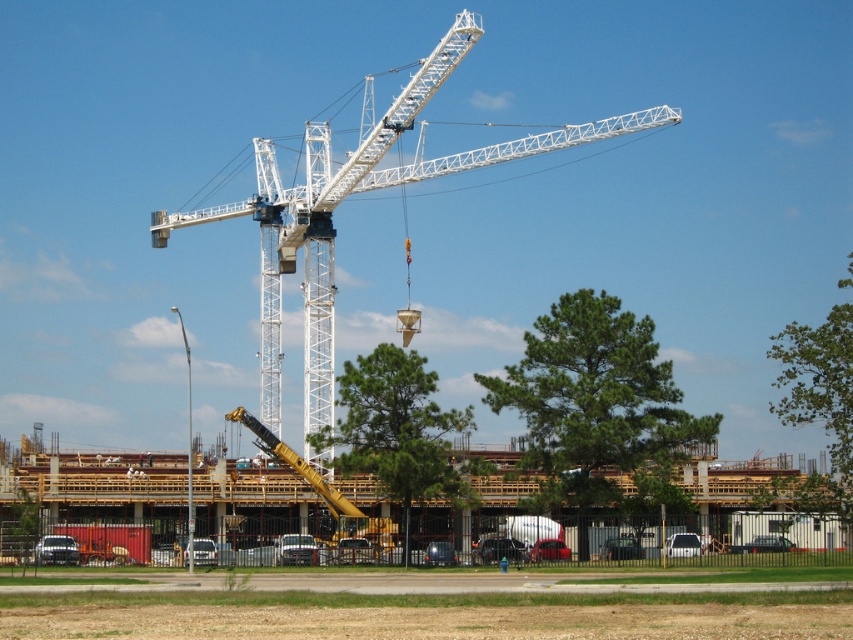
Who is taller, wooden frame at center or matte black truck at lower left?

wooden frame at center is taller.

Is wooden frame at center further to camera compared to matte black truck at lower left?

Yes, it is.

I want to click on wooden frame at center, so click(x=653, y=518).

Who is higher up, yellow metallic crane at center or metallic yellow crane arm at center?

yellow metallic crane at center

Measure the distance between point (302, 467) and camera.

Point (302, 467) and camera are 531.27 feet apart from each other.

Where is `yellow metallic crane at center`? yellow metallic crane at center is located at coordinates (325, 497).

Does white metallic crane at center appear on the left side of matte black truck at lower left?

No, white metallic crane at center is not to the left of matte black truck at lower left.

Does white metallic crane at center appear over matte black truck at lower left?

Yes, white metallic crane at center is above matte black truck at lower left.

Is point (361, 170) positioned in front of point (49, 540)?

No, (361, 170) is behind (49, 540).

The width and height of the screenshot is (853, 640). Identify the location of white metallic crane at center. (345, 196).